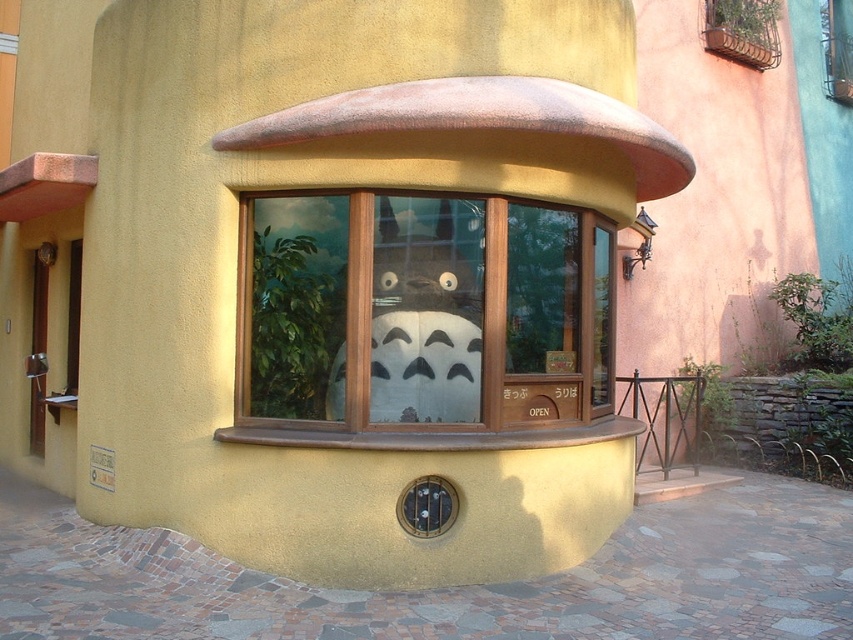
You are an interior designer planning to place a new sofa in the living room. The sofa is 1.8 meters wide. You see the wooden bay window at center and the white matte totoro at center. Can the sofa fit horizontally between these two objects?

The wooden bay window at center is wider than the white matte totoro at center. However, the description does not provide specific measurements for the distance between them, so it is unclear if the sofa will fit horizontally between these two objects.

You are an architect designing a miniature model of this building. You have a limited amount of wood for the window frame. Since the wooden bay window at center is bigger than the white matte totoro at center, which object requires more wood for its frame?

The wooden bay window at center requires more wood for its frame because it is bigger than the white matte totoro at center.